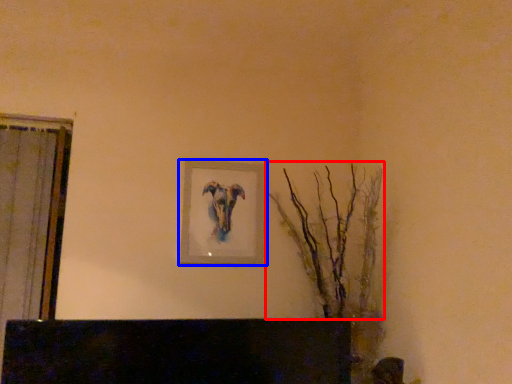
Question: Among these objects, which one is nearest to the camera, tree (highlighted by a red box) or picture frame (highlighted by a blue box)?

Choices:
 (A) tree
 (B) picture frame

Answer: (A)